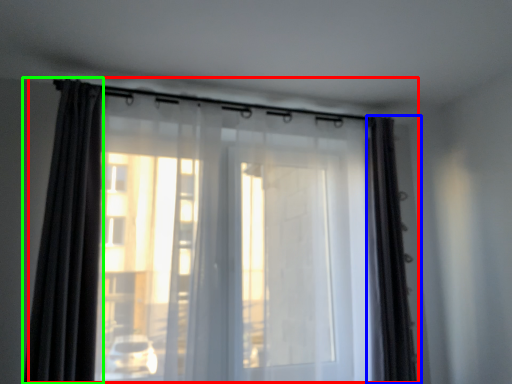
Question: Based on their relative distances, which object is farther from curtain (highlighted by a red box)? Choose from curtain (highlighted by a blue box) and curtain (highlighted by a green box).

Choices:
 (A) curtain
 (B) curtain

Answer: (A)